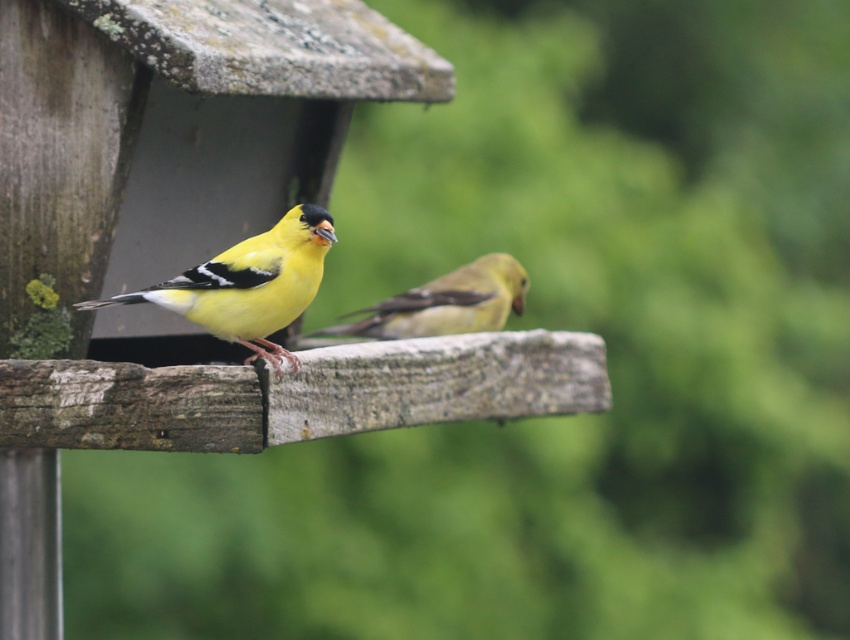
Question: Which point is closer to the camera?

Choices:
 (A) yellow matte bird at center
 (B) yellow matte/glossy bird at center

Answer: (A)

Question: Can you confirm if yellow matte bird at center is bigger than yellow matte/glossy bird at center?

Choices:
 (A) no
 (B) yes

Answer: (B)

Question: Is yellow matte bird at center behind yellow matte/glossy bird at center?

Choices:
 (A) no
 (B) yes

Answer: (A)

Question: Does yellow matte bird at center appear under yellow matte/glossy bird at center?

Choices:
 (A) no
 (B) yes

Answer: (A)